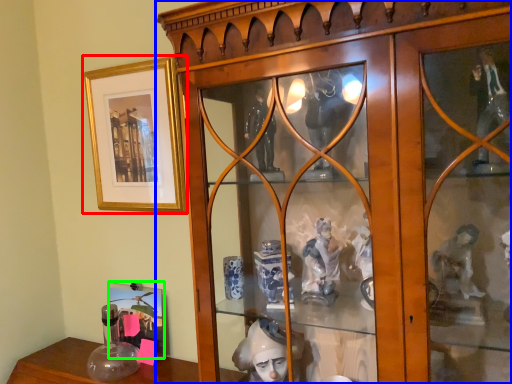
Question: Considering the real-world distances, which object is farthest from picture frame (highlighted by a red box)? furniture (highlighted by a blue box) or picture frame (highlighted by a green box)?

Choices:
 (A) furniture
 (B) picture frame

Answer: (B)